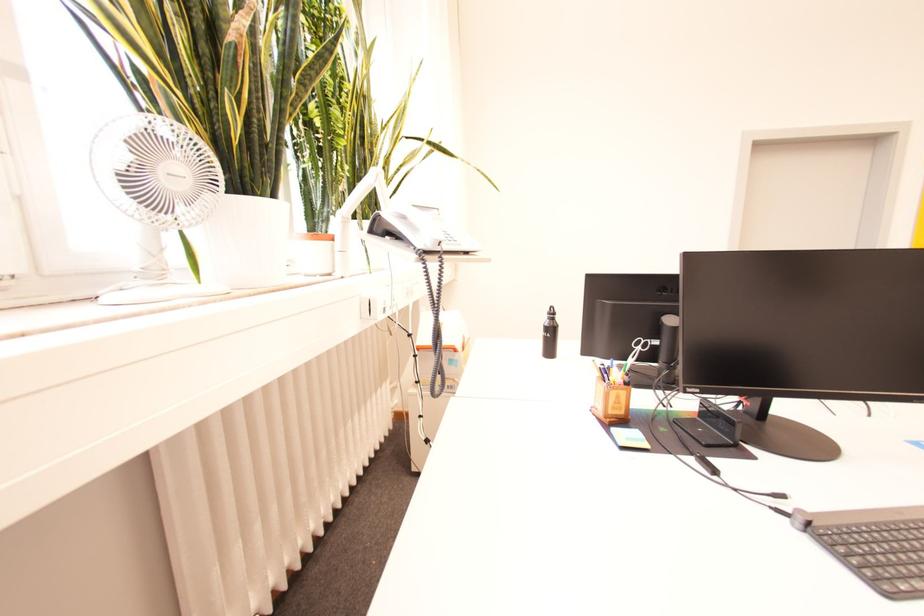
What do you see at coordinates (650, 351) in the screenshot?
I see `the scissors handle` at bounding box center [650, 351].